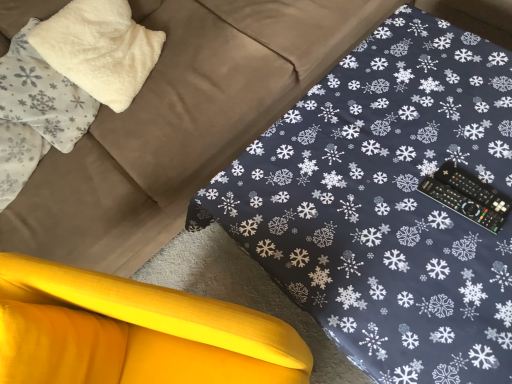
Find the location of a particular element. This screenshot has width=512, height=384. vacant space in front of black plastic remote at right is located at coordinates (475, 274).